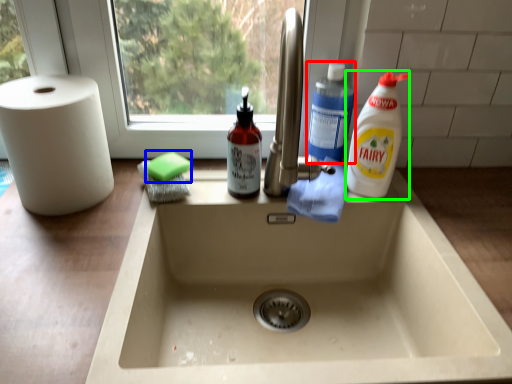
Question: Based on their relative distances, which object is farther from cleaning product (highlighted by a red box)? Choose from soap (highlighted by a blue box) and cleaning product (highlighted by a green box).

Choices:
 (A) soap
 (B) cleaning product

Answer: (A)